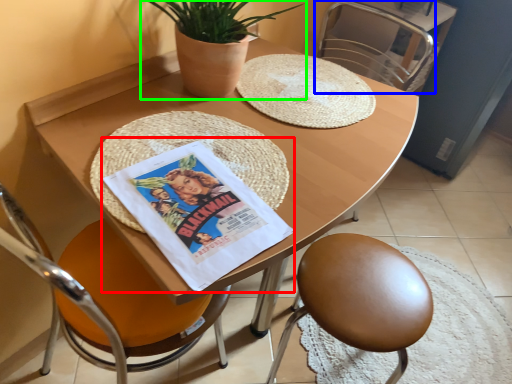
Question: Considering the real-world distances, which object is closest to comic book (highlighted by a red box)? chair (highlighted by a blue box) or houseplant (highlighted by a green box).

Choices:
 (A) chair
 (B) houseplant

Answer: (B)